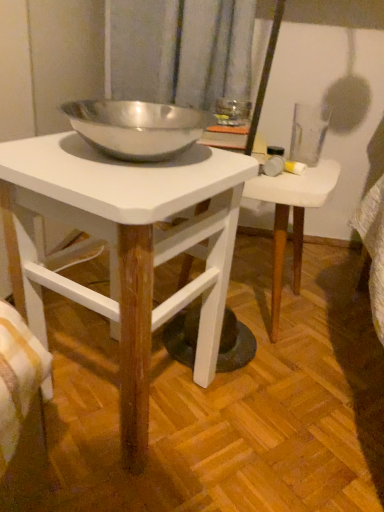
You are a GUI agent. You are given a task and a screenshot of the screen. Output one action in this format:
    pyautogui.click(x=<x>, y=<y>)
    Task: Click on the vacant area that is in front of white wood table at center, which is the first table in back-to-front order
    The width and height of the screenshot is (384, 512).
    Given the screenshot: What is the action you would take?
    pyautogui.click(x=291, y=397)